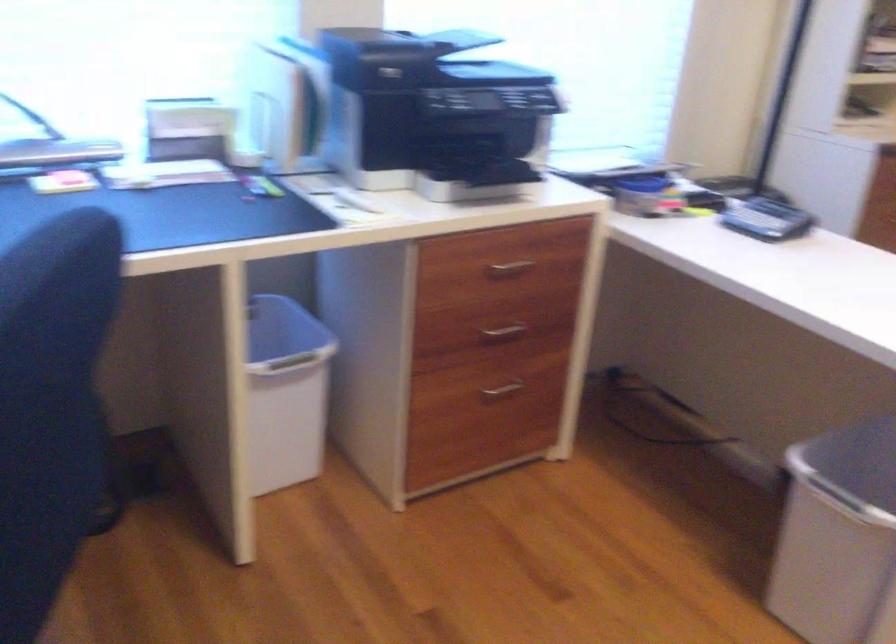
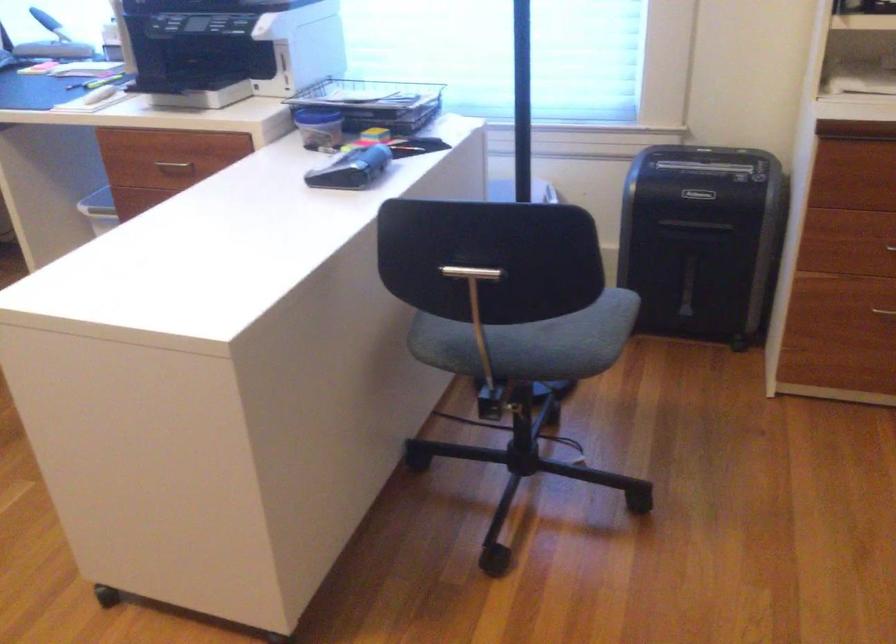
The point at (x=504, y=269) is marked in the first image. Where is the corresponding point in the second image?

(174, 165)